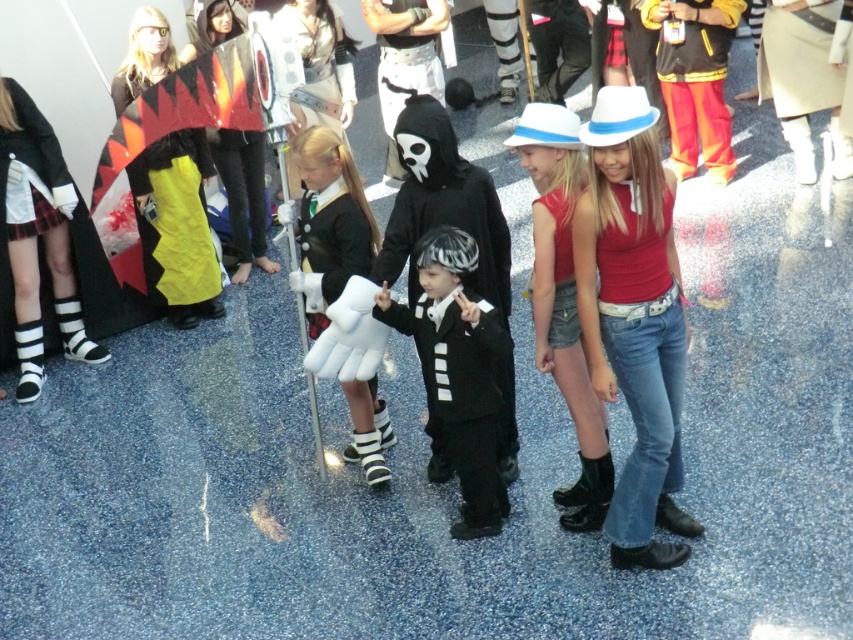
You are a photographer at the event and need to capture a photo where both the denim jeans at center and the white matte gloves at center are clearly visible. Given their sizes, which object should you focus on to ensure both are in frame without zooming in or out?

The denim jeans at center is wider than the white matte gloves at center. To ensure both are in frame without adjusting the zoom, focus on the denim jeans at center since it is larger and will help frame the scene appropriately while keeping the white matte gloves at center visible.

You are standing at the entrance of the event hall and want to find the denim shorts at center. According to the coordinates provided, in which direction should you walk to reach them?

The denim shorts at center is located at coordinates point [563,300], so you should walk towards the center of the event hall to reach them.